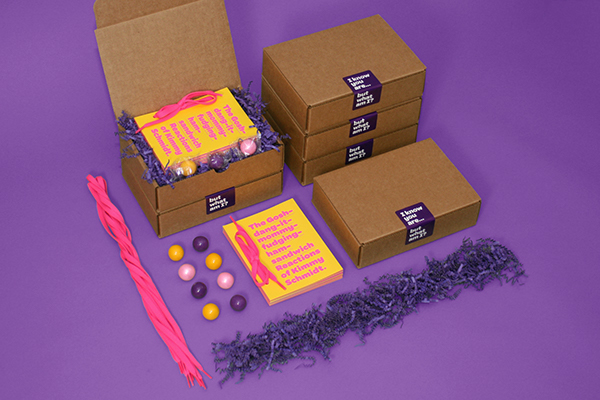
Locate an element on the screen. The image size is (600, 400). boxes is located at coordinates (413, 215).